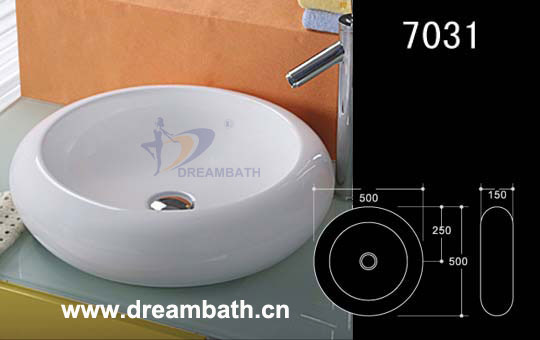
The width and height of the screenshot is (540, 340). I want to click on counter, so click(x=50, y=271).